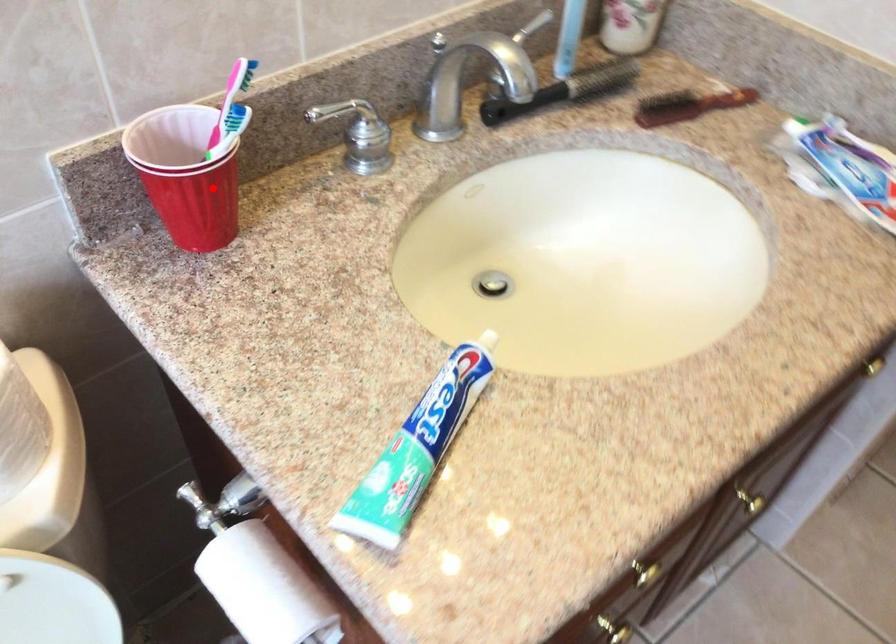
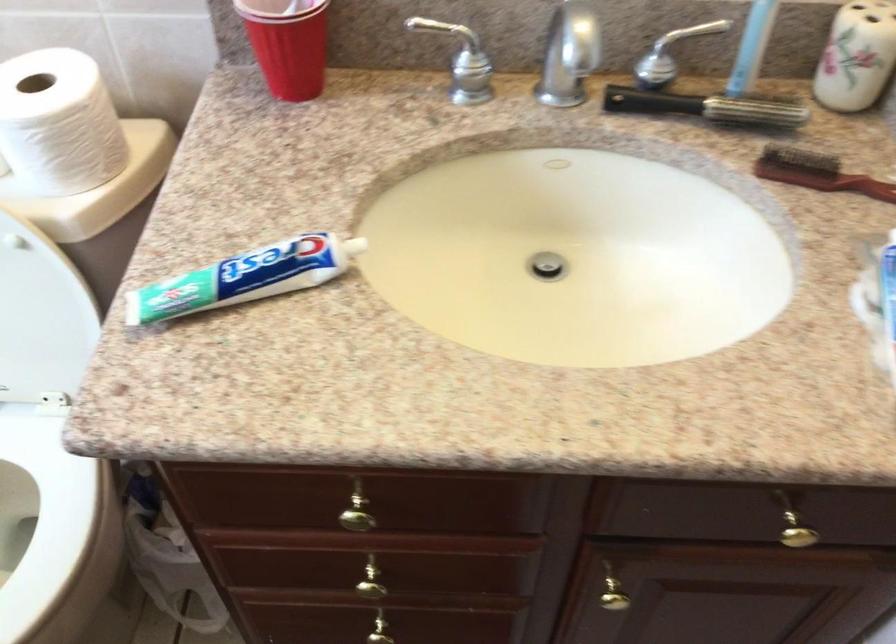
Find the pixel in the second image that matches the highlighted location in the first image.

(288, 44)